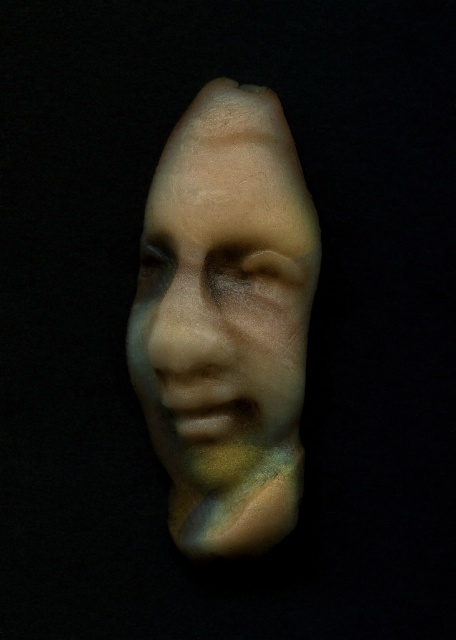
You are an art curator examining the sculpture. You notice the iridescent plastic face at center and the matte beige nose at center. Which part of the sculpture is wider?

The iridescent plastic face at center is wider than the matte beige nose at center.

You are an art conservator examining the sculpture. You notice two points on the sculpture marked as point 1 at coordinates point (x=253, y=340) and point 2 at coordinates point (x=231, y=365). If you were to touch both points simultaneously with your fingertips, which point would feel closer to your fingertips?

Point (x=231, y=365) is closer to the viewer than point (x=253, y=340). Therefore, when touching both points simultaneously, point (x=231, y=365) would feel closer to your fingertips.